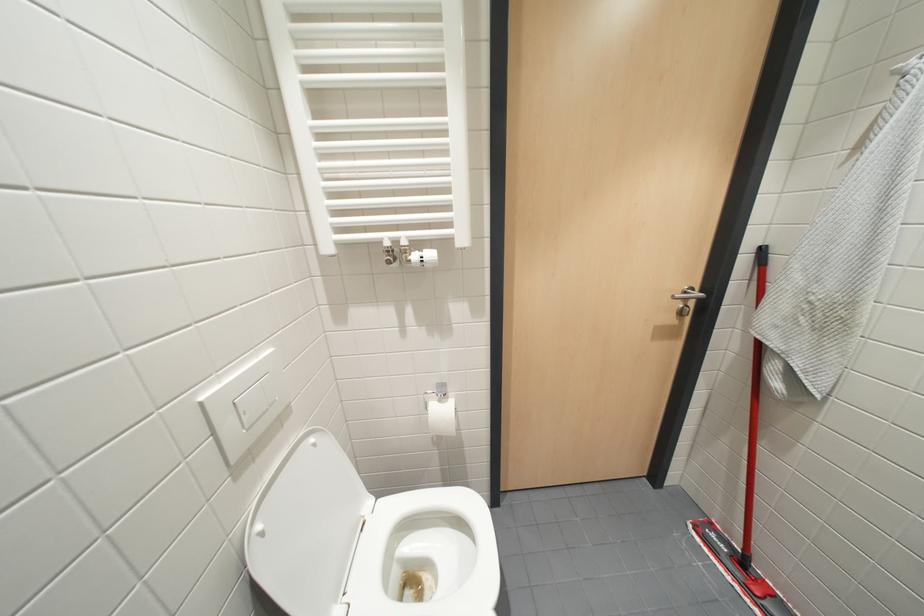
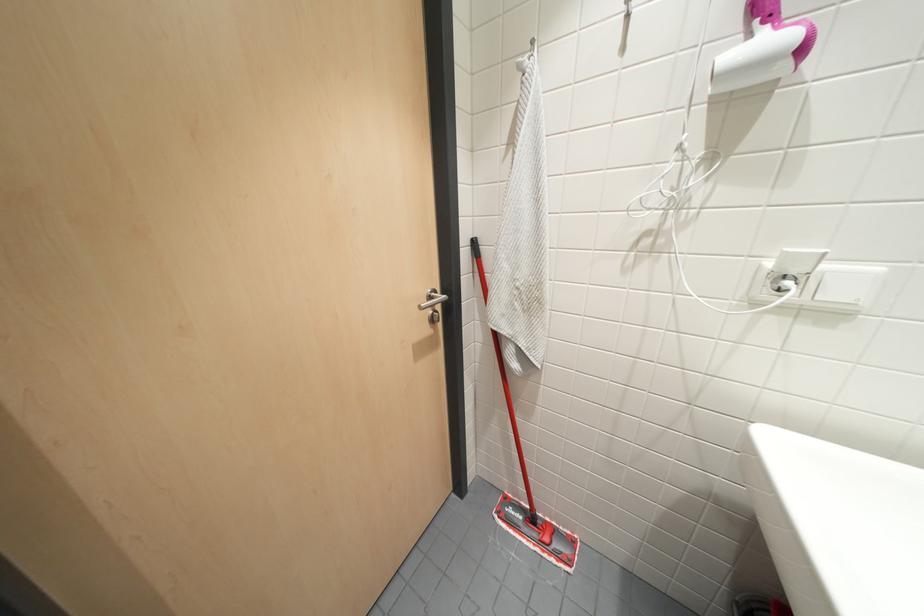
Question: The first image is from the beginning of the video and the second image is from the end. How did the camera likely rotate when shooting the video?

Choices:
 (A) Left
 (B) Right
 (C) Up
 (D) Down

Answer: (B)